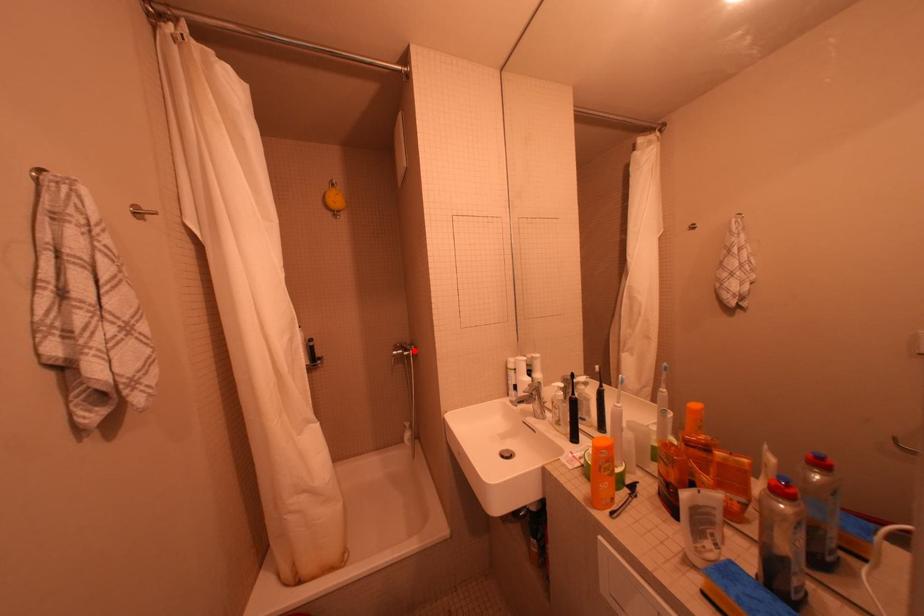
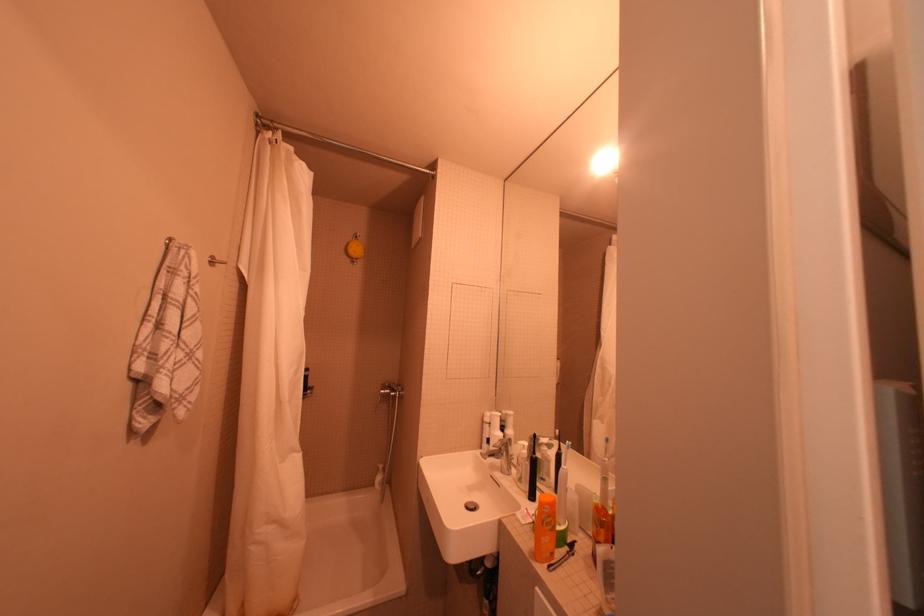
Where in the second image is the point corresponding to the highlighted location from the first image?

(402, 391)